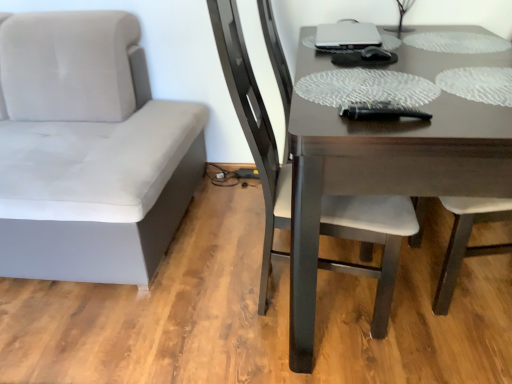
Question: From the image's perspective, is suede gray chair at left, placed as the 2th chair when sorted from right to left, over dark brown wood chair at center, arranged as the second chair when viewed from the left?

Choices:
 (A) no
 (B) yes

Answer: (B)

Question: Is dark brown wood chair at center, acting as the 1th chair starting from the right, surrounded by suede gray chair at left, positioned as the 1th chair in left-to-right order?

Choices:
 (A) yes
 (B) no

Answer: (B)

Question: From a real-world perspective, is suede gray chair at left, positioned as the 1th chair in left-to-right order, positioned over dark brown wood chair at center, arranged as the second chair when viewed from the left, based on gravity?

Choices:
 (A) yes
 (B) no

Answer: (B)

Question: Is suede gray chair at left, positioned as the 1th chair in left-to-right order, looking in the opposite direction of dark brown wood chair at center, arranged as the second chair when viewed from the left?

Choices:
 (A) yes
 (B) no

Answer: (B)

Question: From the image's perspective, is suede gray chair at left, positioned as the 1th chair in left-to-right order, beneath dark brown wood chair at center, arranged as the second chair when viewed from the left?

Choices:
 (A) no
 (B) yes

Answer: (A)

Question: Considering the relative sizes of suede gray chair at left, positioned as the 1th chair in left-to-right order, and dark brown wood chair at center, acting as the 1th chair starting from the right, in the image provided, is suede gray chair at left, positioned as the 1th chair in left-to-right order, thinner than dark brown wood chair at center, acting as the 1th chair starting from the right,?

Choices:
 (A) yes
 (B) no

Answer: (B)

Question: From the image's perspective, is satin silver laptop at upper center on suede gray chair at left, positioned as the 1th chair in left-to-right order?

Choices:
 (A) no
 (B) yes

Answer: (B)

Question: From the image's perspective, is satin silver laptop at upper center beneath suede gray chair at left, placed as the 2th chair when sorted from right to left?

Choices:
 (A) yes
 (B) no

Answer: (B)

Question: Would you say satin silver laptop at upper center is outside suede gray chair at left, placed as the 2th chair when sorted from right to left?

Choices:
 (A) no
 (B) yes

Answer: (B)

Question: Is satin silver laptop at upper center behind suede gray chair at left, placed as the 2th chair when sorted from right to left?

Choices:
 (A) no
 (B) yes

Answer: (B)

Question: Is the position of satin silver laptop at upper center less distant than that of suede gray chair at left, positioned as the 1th chair in left-to-right order?

Choices:
 (A) no
 (B) yes

Answer: (A)

Question: Could you tell me if satin silver laptop at upper center is facing suede gray chair at left, placed as the 2th chair when sorted from right to left?

Choices:
 (A) no
 (B) yes

Answer: (B)

Question: Is dark brown wooden table at center completely or partially inside suede gray chair at left, placed as the 2th chair when sorted from right to left?

Choices:
 (A) yes
 (B) no

Answer: (B)